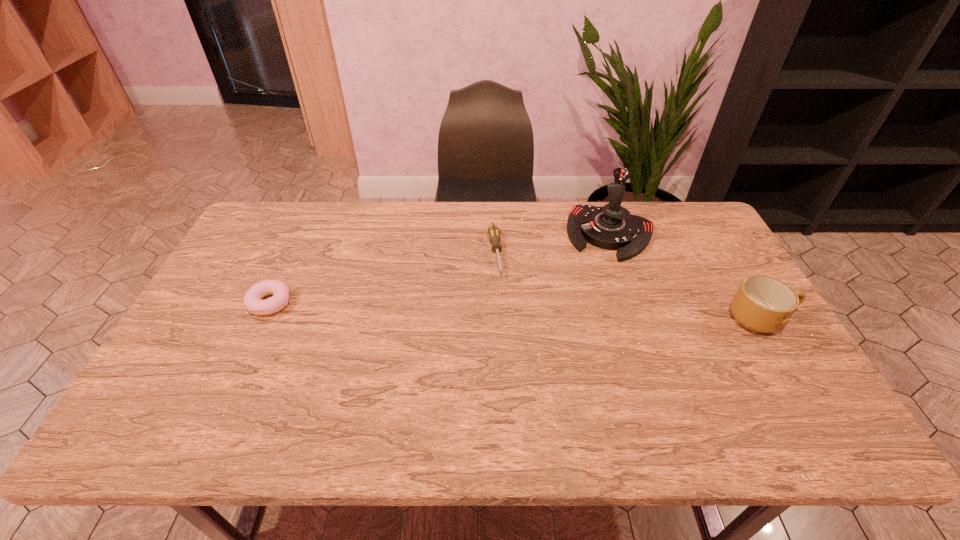
The width and height of the screenshot is (960, 540). What are the coordinates of `vacant area between the doughnut and the joystick` in the screenshot? It's located at (441, 268).

Where is `vacant region between the joystick and the screwdriver`? The image size is (960, 540). vacant region between the joystick and the screwdriver is located at coordinates (553, 244).

Identify the location of free space between the third object from right to left and the joystick. This screenshot has width=960, height=540. (553, 244).

This screenshot has height=540, width=960. Find the location of `empty location between the tallest object and the doughnut`. empty location between the tallest object and the doughnut is located at coordinates (441, 268).

I want to click on the second closest object to the second tallest object, so tap(493, 232).

At what (x,y) coordinates should I click in order to perform the action: click on object that is the second closest to the leftmost object. Please return your answer as a coordinate pair (x, y). This screenshot has height=540, width=960. Looking at the image, I should click on (612, 227).

Identify the location of free space that satisfies the following two spatial constraints: 1. on the front side of the doughnut; 2. on the side with the handle of the third shortest object. (263, 319).

This screenshot has height=540, width=960. Identify the location of blank area in the image that satisfies the following two spatial constraints: 1. on the front side of the joystick; 2. on the side with the handle of the third shortest object. click(x=640, y=319).

The image size is (960, 540). Find the location of `free point that satisfies the following two spatial constraints: 1. on the back side of the second object from left to right; 2. on the right side of the leftmost object`. free point that satisfies the following two spatial constraints: 1. on the back side of the second object from left to right; 2. on the right side of the leftmost object is located at coordinates tap(294, 253).

Where is `vacant region that satisfies the following two spatial constraints: 1. on the back side of the doughnut; 2. on the left side of the screwdriver`? The height and width of the screenshot is (540, 960). vacant region that satisfies the following two spatial constraints: 1. on the back side of the doughnut; 2. on the left side of the screwdriver is located at coordinates click(x=294, y=253).